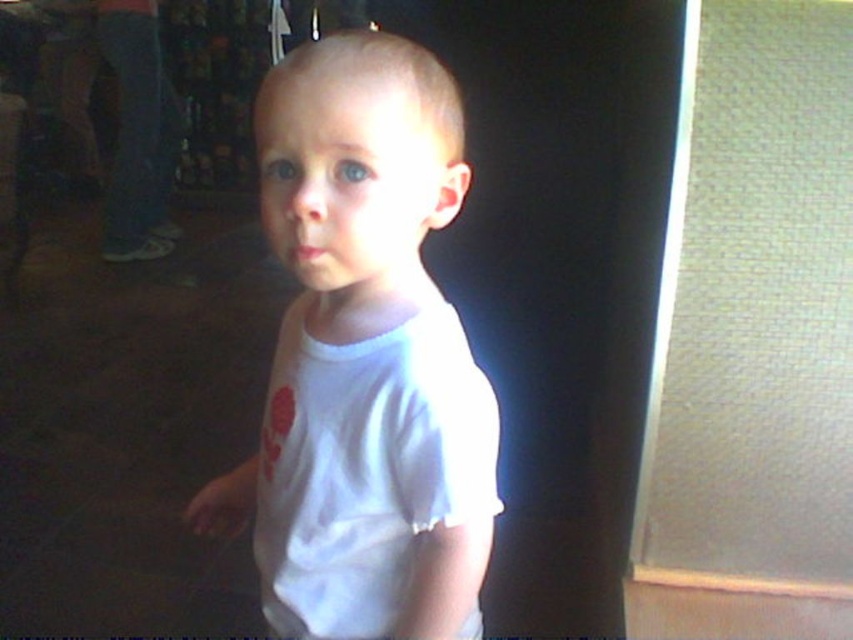
The child is wearing two shirts. The white cotton shirt at center and the white matte shirt at center. Which one is shorter?

The white cotton shirt at center is shorter than the white matte shirt at center.